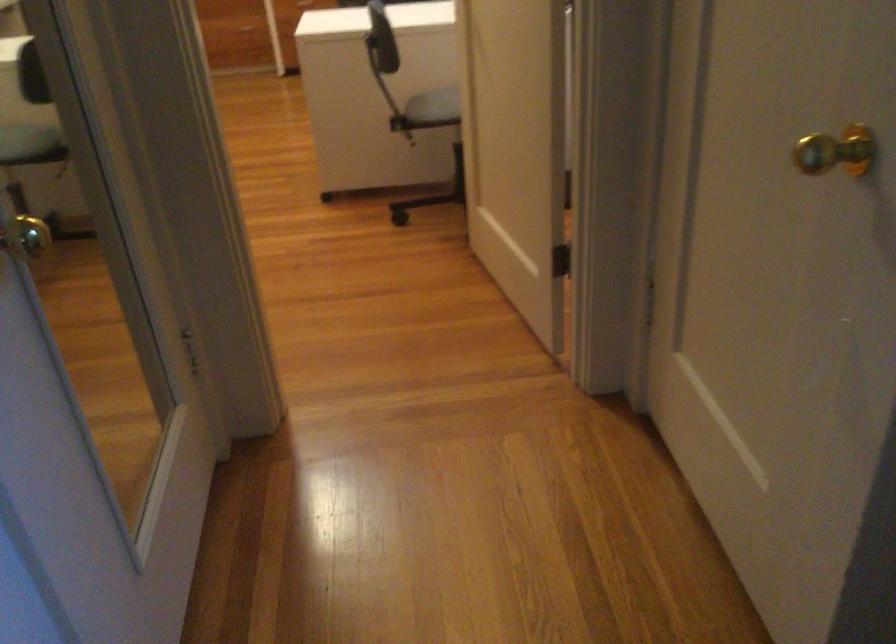
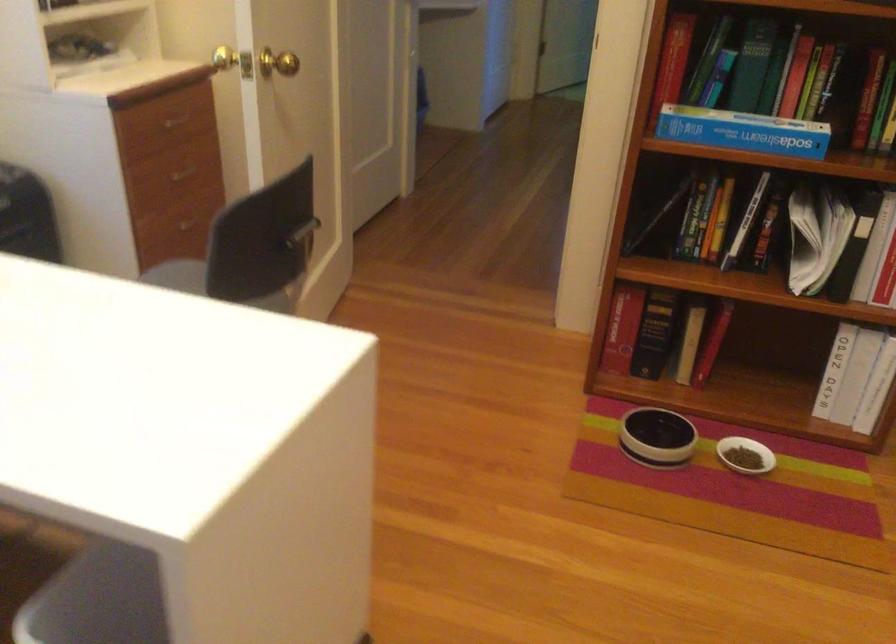
Question: I am providing you with two images of the same scene from different viewpoints. Please identify which objects are invisible in image2.

Choices:
 (A) light blue cap
 (B) chair sitting surface
 (C) chair back handle
 (D) black and white bowl

Answer: (B)